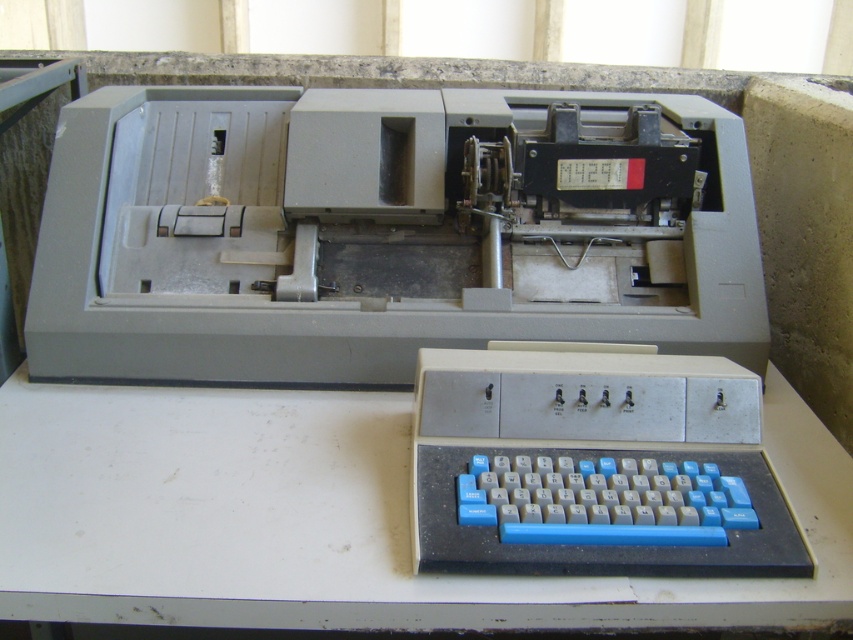
Question: Is gray plastic register at center in front of blue plastic keyboard at lower center?

Choices:
 (A) yes
 (B) no

Answer: (B)

Question: Which object is the farthest from the white matte table at center?

Choices:
 (A) gray plastic register at center
 (B) blue plastic keyboard at lower center

Answer: (A)

Question: Which is nearer to the white matte table at center?

Choices:
 (A) blue plastic keyboard at lower center
 (B) gray plastic register at center

Answer: (A)

Question: Does gray plastic register at center have a smaller size compared to white matte table at center?

Choices:
 (A) yes
 (B) no

Answer: (B)

Question: Which is nearer to the gray plastic register at center?

Choices:
 (A) blue plastic keyboard at lower center
 (B) white matte table at center

Answer: (B)

Question: Is gray plastic register at center thinner than blue plastic keyboard at lower center?

Choices:
 (A) yes
 (B) no

Answer: (B)